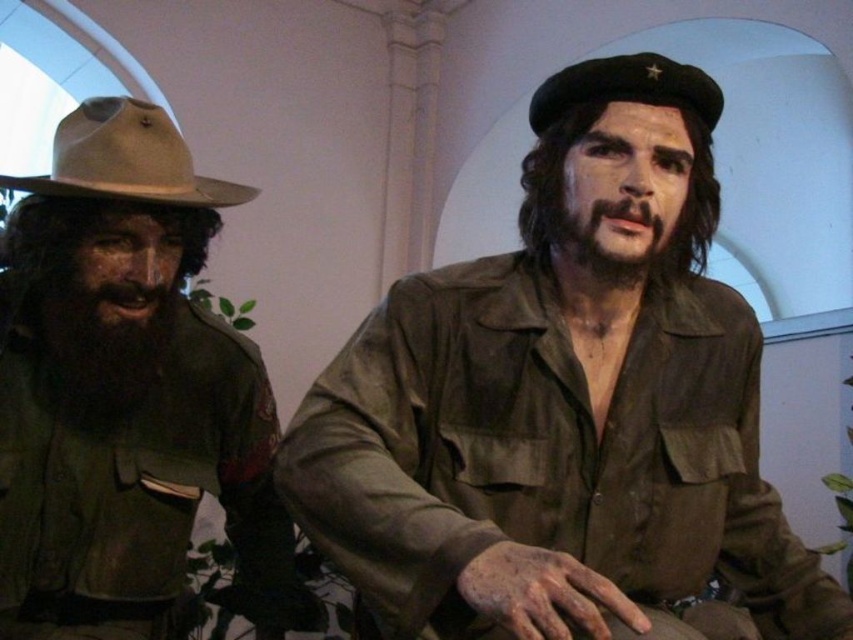
Does dark brown fuzzy beard at left appear under tan felt cowboy hat at left?

Indeed, dark brown fuzzy beard at left is positioned under tan felt cowboy hat at left.

Between point (113, 412) and point (125, 122), which one is positioned in front?

Point (125, 122) is more forward.

This screenshot has height=640, width=853. Identify the location of dark brown fuzzy beard at left. (102, 342).

Is matte green uniform at left to the right of dark brown hair at center from the viewer's perspective?

In fact, matte green uniform at left is to the left of dark brown hair at center.

Who is positioned more to the left, matte green uniform at left or dark brown hair at center?

Positioned to the left is matte green uniform at left.

Is point (247, 397) closer to viewer compared to point (602, 220)?

No, it is not.

Find the location of a particular element. This screenshot has height=640, width=853. matte green uniform at left is located at coordinates (126, 385).

The width and height of the screenshot is (853, 640). Describe the element at coordinates (126, 160) in the screenshot. I see `tan felt cowboy hat at left` at that location.

This screenshot has width=853, height=640. What are the coordinates of `tan felt cowboy hat at left` in the screenshot? It's located at (126, 160).